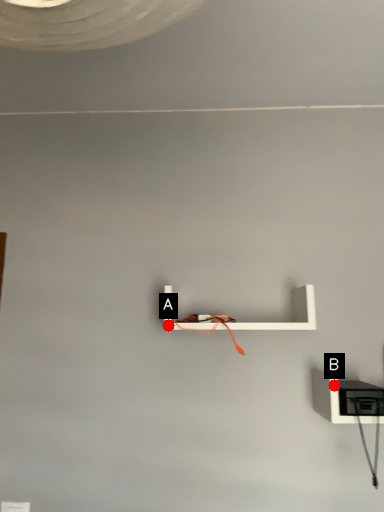
Question: Two points are circled on the image, labeled by A and B beside each circle. Which point appears farthest from the camera in this image?

Choices:
 (A) A is further
 (B) B is further

Answer: (A)